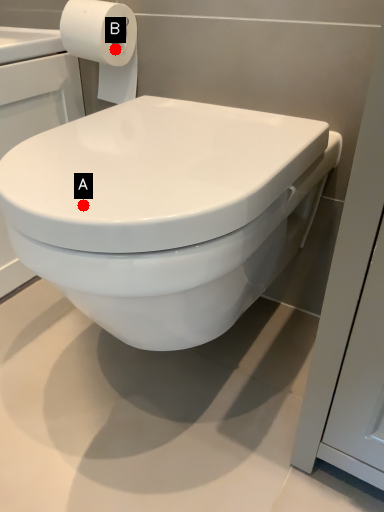
Question: Two points are circled on the image, labeled by A and B beside each circle. Among these points, which one is farthest from the camera?

Choices:
 (A) A is further
 (B) B is further

Answer: (B)